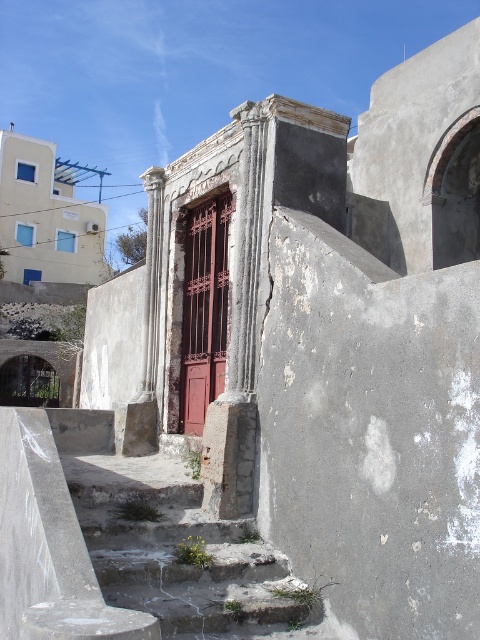
Question: Which point is farther to the camera?

Choices:
 (A) rusty concrete stairs at lower center
 (B) rusty metal door at center

Answer: (B)

Question: Among these points, which one is farthest from the camera?

Choices:
 (A) (214, 358)
 (B) (159, 596)

Answer: (A)

Question: Among these objects, which one is nearest to the camera?

Choices:
 (A) rusty metal door at center
 (B) rusty concrete stairs at lower center

Answer: (B)

Question: Is rusty concrete stairs at lower center wider than rusty metal door at center?

Choices:
 (A) no
 (B) yes

Answer: (B)

Question: Does rusty concrete stairs at lower center have a lesser width compared to rusty metal door at center?

Choices:
 (A) no
 (B) yes

Answer: (A)

Question: From the image, what is the correct spatial relationship of rusty concrete stairs at lower center in relation to rusty metal door at center?

Choices:
 (A) left
 (B) right

Answer: (A)